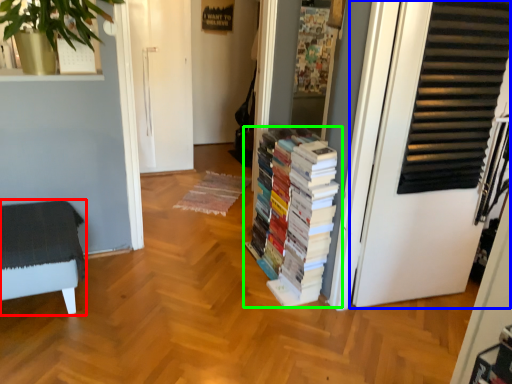
Question: Which is farther away from furniture (highlighted by a red box)? door (highlighted by a blue box) or book (highlighted by a green box)?

Choices:
 (A) door
 (B) book

Answer: (A)